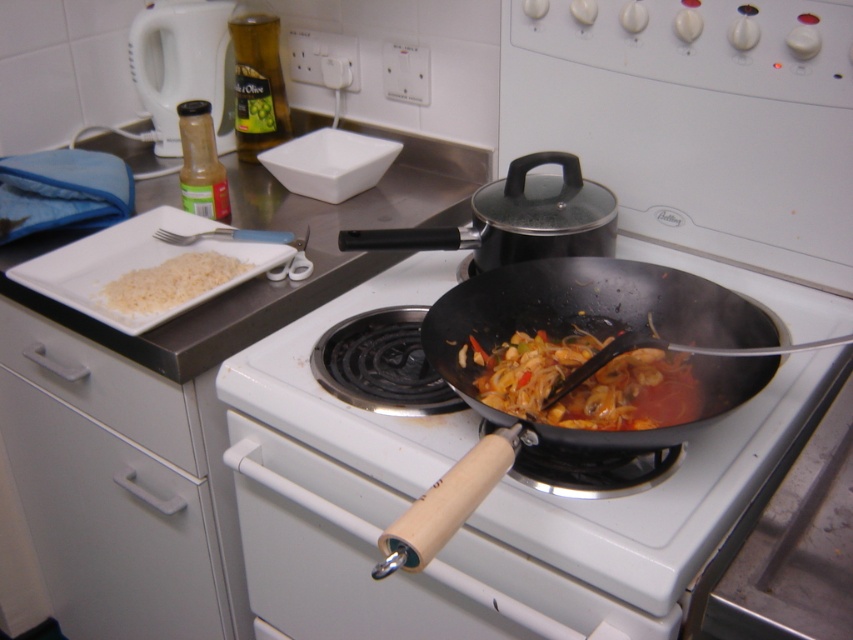
You are standing in the kitchen and want to reach both the plate with cooked rice and the scissors. The coordinates of the plate are point (227, 72) and the scissors are at point (114, 300). Which item is closer to you?

Point (114, 300) is closer to you because point (227, 72) is behind it.